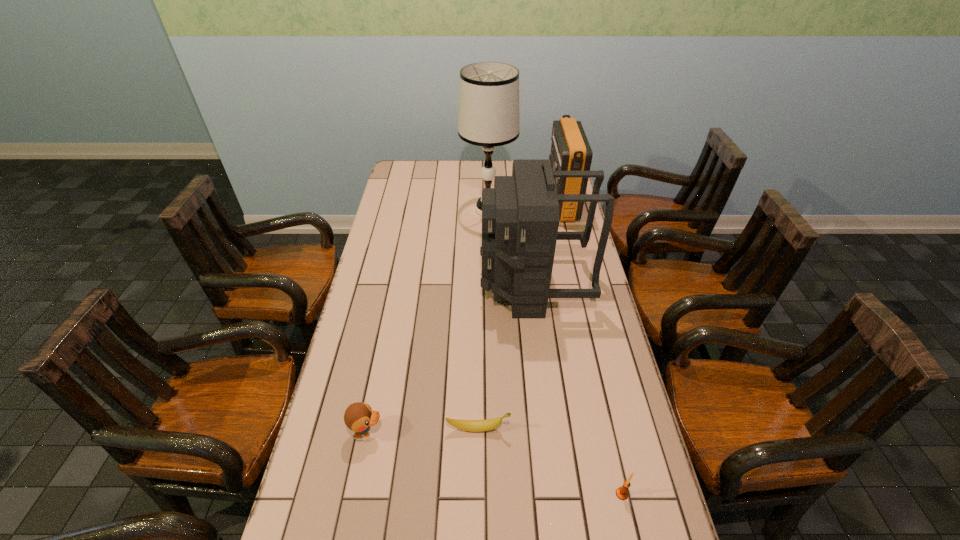
Locate an element on the screen. The image size is (960, 540). radio receiver at the right edge is located at coordinates (570, 151).

Where is `candle_holder located at the right edge`? This screenshot has width=960, height=540. candle_holder located at the right edge is located at coordinates (621, 492).

Identify the location of object at the far right corner. The image size is (960, 540). (570, 151).

Where is `vacant space at the far edge`? The height and width of the screenshot is (540, 960). vacant space at the far edge is located at coordinates (437, 180).

The width and height of the screenshot is (960, 540). In the image, there is a desktop. Identify the location of vacant area at the left edge. (379, 433).

Locate an element on the screen. vacant space at the right edge of the desktop is located at coordinates (580, 262).

Identify the location of vacant space at the far left corner. This screenshot has height=540, width=960. (423, 165).

The width and height of the screenshot is (960, 540). Identify the location of free space between the duck and the third farthest object. (450, 359).

The image size is (960, 540). I want to click on vacant area that lies between the candle_holder and the backpack, so click(578, 389).

You are a GUI agent. You are given a task and a screenshot of the screen. Output one action in this format:
    pyautogui.click(x=<x>, y=<y>)
    Task: Click on the free spot between the second tallest object and the duck
    The width and height of the screenshot is (960, 540).
    Given the screenshot: What is the action you would take?
    pyautogui.click(x=450, y=359)